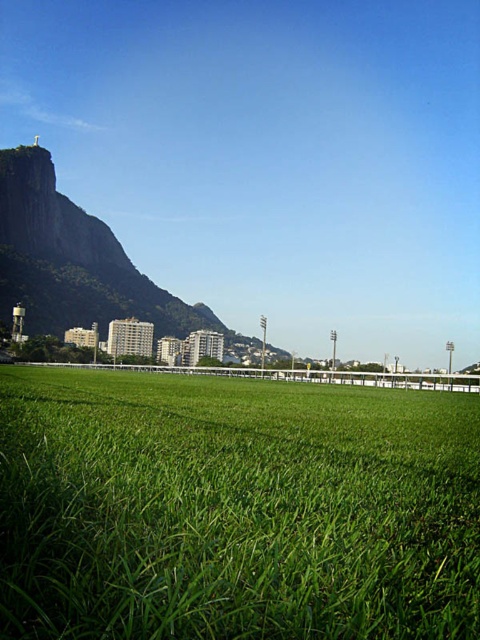
Question: Does green grass at center lie in front of green grassy hill at left?

Choices:
 (A) yes
 (B) no

Answer: (A)

Question: Can you confirm if green grass at center is positioned below green grassy hill at left?

Choices:
 (A) no
 (B) yes

Answer: (B)

Question: Which of the following is the farthest from the observer?

Choices:
 (A) [191, 433]
 (B) [168, 301]

Answer: (B)

Question: Which object appears closest to the camera in this image?

Choices:
 (A) green grassy hill at left
 (B) green grass at center

Answer: (B)

Question: Can you confirm if green grass at center is positioned above green grassy hill at left?

Choices:
 (A) yes
 (B) no

Answer: (B)